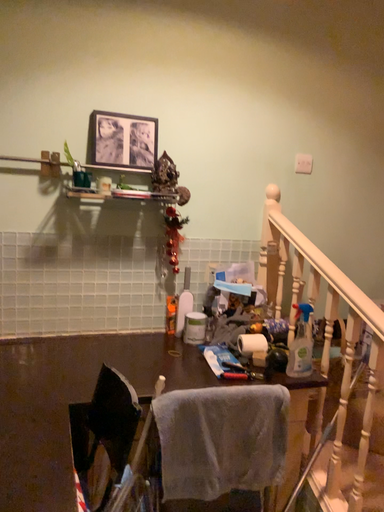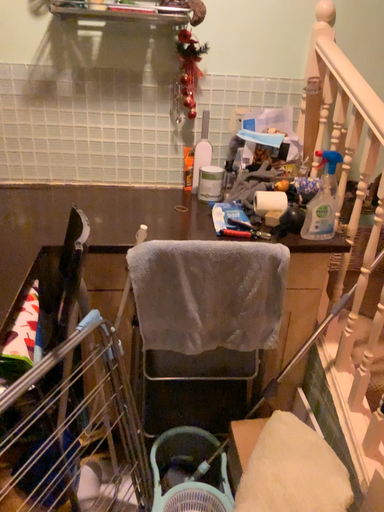
Question: Which way did the camera rotate in the video?

Choices:
 (A) rotated downward
 (B) rotated upward

Answer: (A)